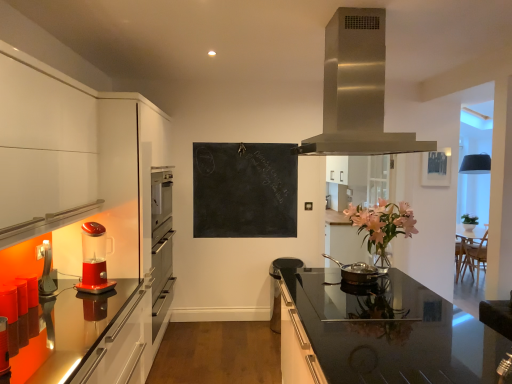
Locate an element on the screen. The height and width of the screenshot is (384, 512). black glass countertop at center is located at coordinates (379, 333).

The height and width of the screenshot is (384, 512). In order to click on stainless steel range hood at upper center in this screenshot , I will do `click(357, 90)`.

Consider the image. How much space does bronze metallic pan at center, the first kitchen appliance viewed from the right, occupy horizontally?

bronze metallic pan at center, the first kitchen appliance viewed from the right, is 19.74 inches wide.

Describe the element at coordinates (94, 260) in the screenshot. The height and width of the screenshot is (384, 512). I see `translucent red blender at left, which is the 1th kitchen appliance from left to right` at that location.

The image size is (512, 384). What are the coordinates of `black chalkboard at center` in the screenshot? It's located at (244, 190).

What do you see at coordinates (436, 168) in the screenshot? This screenshot has width=512, height=384. I see `metallic silver picture frame at upper right` at bounding box center [436, 168].

Locate an element on the screen. black glass countertop at center is located at coordinates (379, 333).

Between bronze metallic pan at center, the first kitchen appliance viewed from the right, and stainless steel range hood at upper center, which one is positioned in front?

stainless steel range hood at upper center is closer to the camera.

How much distance is there between bronze metallic pan at center, which appears as the 2th kitchen appliance when viewed from the left, and stainless steel range hood at upper center?

They are 3.60 feet apart.

Visually, is bronze metallic pan at center, which appears as the 2th kitchen appliance when viewed from the left, positioned to the left or to the right of stainless steel range hood at upper center?

Clearly, bronze metallic pan at center, which appears as the 2th kitchen appliance when viewed from the left, is on the right of stainless steel range hood at upper center in the image.

From the image's perspective, which object appears higher, bronze metallic pan at center, which appears as the 2th kitchen appliance when viewed from the left, or stainless steel range hood at upper center?

stainless steel range hood at upper center, from the image's perspective.

Does metallic silver picture frame at upper right have a greater width compared to black glass countertop at center?

In fact, metallic silver picture frame at upper right might be narrower than black glass countertop at center.

Is metallic silver picture frame at upper right turned away from black glass countertop at center?

No.

Does point (441, 186) come farther from viewer compared to point (411, 344)?

Yes, point (441, 186) is farther from viewer.

Is black chalkboard at center oriented towards black glass countertop at center?

Yes, black chalkboard at center is oriented towards black glass countertop at center.

How many degrees apart are the facing directions of black chalkboard at center and black glass countertop at center?

They differ by 89.2 degrees in their facing directions.

Based on the photo, who is smaller, black chalkboard at center or black glass countertop at center?

black chalkboard at center.

Which is behind, point (356, 270) or point (289, 300)?

Positioned behind is point (356, 270).

Considering the positions of objects bronze metallic pan at center, the first kitchen appliance viewed from the right, and black glass countertop at center in the image provided, who is in front, bronze metallic pan at center, the first kitchen appliance viewed from the right, or black glass countertop at center?

Answer: black glass countertop at center is in front.

Is bronze metallic pan at center, the first kitchen appliance viewed from the right, completely or partially outside of black glass countertop at center?

Yes, bronze metallic pan at center, the first kitchen appliance viewed from the right, is located beyond the bounds of black glass countertop at center.

Is bronze metallic pan at center, which appears as the 2th kitchen appliance when viewed from the left, looking in the opposite direction of black glass countertop at center?

No, bronze metallic pan at center, which appears as the 2th kitchen appliance when viewed from the left, is not facing the opposite direction of black glass countertop at center.

Between stainless steel range hood at upper center and bronze metallic pan at center, the first kitchen appliance viewed from the right, which one has more height?

With more height is stainless steel range hood at upper center.

Is stainless steel range hood at upper center oriented away from bronze metallic pan at center, which appears as the 2th kitchen appliance when viewed from the left?

No, stainless steel range hood at upper center's orientation is not away from bronze metallic pan at center, which appears as the 2th kitchen appliance when viewed from the left.

Is the surface of stainless steel range hood at upper center in direct contact with bronze metallic pan at center, which appears as the 2th kitchen appliance when viewed from the left?

They are not placed beside each other.

Is translucent red blender at left, arranged as the second kitchen appliance when viewed from the right, thinner than black glass countertop at center?

Yes, translucent red blender at left, arranged as the second kitchen appliance when viewed from the right, is thinner than black glass countertop at center.

Is translucent red blender at left, arranged as the second kitchen appliance when viewed from the right, positioned before black glass countertop at center?

No, translucent red blender at left, arranged as the second kitchen appliance when viewed from the right, is behind black glass countertop at center.

Do you think translucent red blender at left, which is the 1th kitchen appliance from left to right, is within black glass countertop at center, or outside of it?

translucent red blender at left, which is the 1th kitchen appliance from left to right, lies outside black glass countertop at center.

From the picture: Is translucent red blender at left, arranged as the second kitchen appliance when viewed from the right, smaller than black glass countertop at center?

Correct, translucent red blender at left, arranged as the second kitchen appliance when viewed from the right, occupies less space than black glass countertop at center.

Is point (390, 340) closer or farther from the camera than point (342, 43)?

Point (390, 340) is positioned farther from the camera compared to point (342, 43).

Which of these two, black glass countertop at center or stainless steel range hood at upper center, stands shorter?

With less height is stainless steel range hood at upper center.

How many degrees apart are the facing directions of black glass countertop at center and stainless steel range hood at upper center?

180 degrees separate the facing orientations of black glass countertop at center and stainless steel range hood at upper center.

Between black glass countertop at center and stainless steel range hood at upper center, which one appears on the right side from the viewer's perspective?

Positioned to the right is black glass countertop at center.

This screenshot has width=512, height=384. Find the location of `the 2nd kitchen appliance behind the stainless steel range hood at upper center`. the 2nd kitchen appliance behind the stainless steel range hood at upper center is located at coordinates (357, 272).

You are a GUI agent. You are given a task and a screenshot of the screen. Output one action in this format:
    pyautogui.click(x=<x>, y=<y>)
    Task: Click on the picture frame above the black glass countertop at center (from the image's perspective)
    The width and height of the screenshot is (512, 384).
    Given the screenshot: What is the action you would take?
    pyautogui.click(x=436, y=168)

Which object lies nearer to the anchor point metallic silver picture frame at upper right, bronze metallic pan at center, which appears as the 2th kitchen appliance when viewed from the left, or black chalkboard at center?

black chalkboard at center.

Based on their spatial positions, is black glass countertop at center or metallic silver picture frame at upper right further from stainless steel range hood at upper center?

metallic silver picture frame at upper right lies further to stainless steel range hood at upper center than the other object.

Looking at the image, which one is located closer to black chalkboard at center, stainless steel range hood at upper center or bronze metallic pan at center, the first kitchen appliance viewed from the right?

Based on the image, bronze metallic pan at center, the first kitchen appliance viewed from the right, appears to be nearer to black chalkboard at center.

Based on their spatial positions, is translucent red blender at left, arranged as the second kitchen appliance when viewed from the right, or metallic silver picture frame at upper right further from black glass countertop at center?

metallic silver picture frame at upper right is further to black glass countertop at center.

When comparing their distances from black glass countertop at center, does bronze metallic pan at center, the first kitchen appliance viewed from the right, or stainless steel range hood at upper center seem closer?

Among the two, bronze metallic pan at center, the first kitchen appliance viewed from the right, is located nearer to black glass countertop at center.

Based on their spatial positions, is metallic silver picture frame at upper right or black chalkboard at center further from black glass countertop at center?

metallic silver picture frame at upper right is positioned further to the anchor black glass countertop at center.

From the image, which object appears to be nearer to black glass countertop at center, stainless steel range hood at upper center or translucent red blender at left, which is the 1th kitchen appliance from left to right?

stainless steel range hood at upper center is positioned closer to the anchor black glass countertop at center.

Which object lies nearer to the anchor point translucent red blender at left, which is the 1th kitchen appliance from left to right, metallic silver picture frame at upper right or black glass countertop at center?

black glass countertop at center is closer to translucent red blender at left, which is the 1th kitchen appliance from left to right.

Find the location of a particular element. home appliance positioned between black glass countertop at center and black chalkboard at center from near to far is located at coordinates (357, 90).

Where is `kitchen appliance between black chalkboard at center and metallic silver picture frame at upper right`? This screenshot has height=384, width=512. kitchen appliance between black chalkboard at center and metallic silver picture frame at upper right is located at coordinates (357, 272).

I want to click on kitchen appliance between translucent red blender at left, which is the 1th kitchen appliance from left to right, and black chalkboard at center from front to back, so click(x=357, y=272).

Find the location of a particular element. kitchen appliance located between translucent red blender at left, arranged as the second kitchen appliance when viewed from the right, and metallic silver picture frame at upper right in the left-right direction is located at coordinates (357, 272).